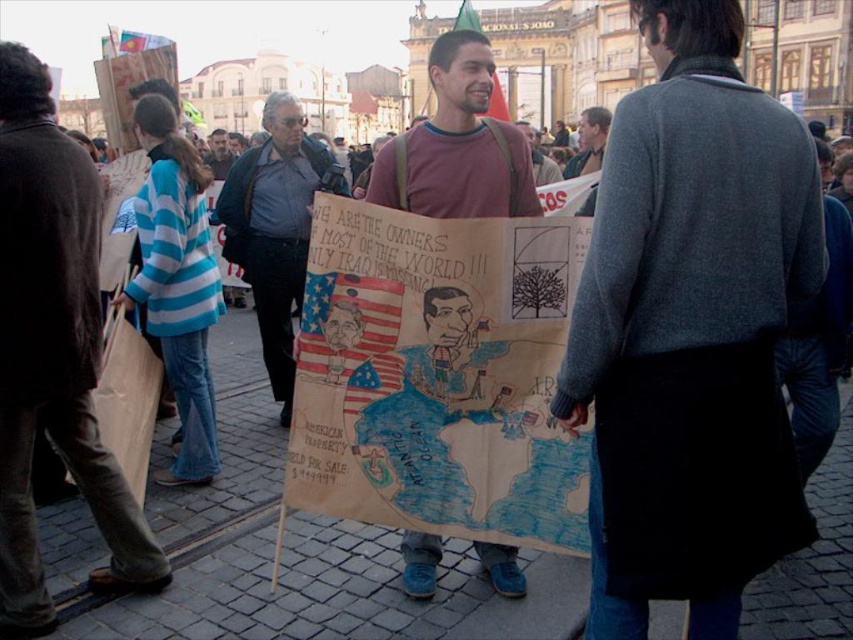
You are a drone operator trying to capture the protest scene. The protest has two key points of interest marked as point 1 at (715, 99) and point 2 at 0.645, 0.287. Your drone can only capture a single image with a maximum coverage of 50 meters. Can your drone capture both points in one shot?

The two points are 50.15 meters apart, which exceeds the drone camera coverage of 50 meters. Therefore, the drone cannot capture both points in a single image.

What is located at the coordinates point (691,330)?

The gray wool sweater at center is located at point (691,330).